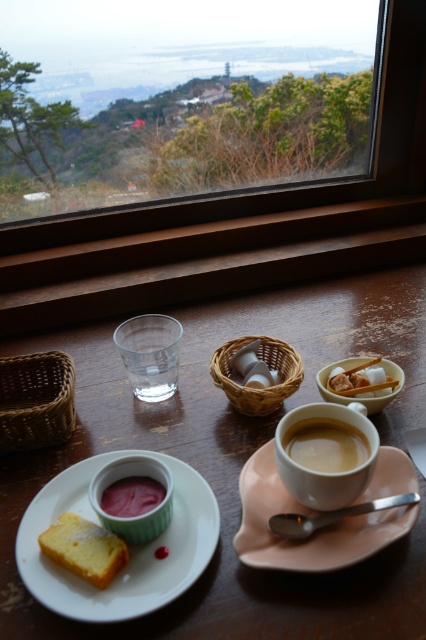
Question: Considering the relative positions of wooden table at center and pink matte saucer at center in the image provided, where is wooden table at center located with respect to pink matte saucer at center?

Choices:
 (A) below
 (B) above

Answer: (B)

Question: Which point appears closest to the camera in this image?

Choices:
 (A) (118, 492)
 (B) (8, 362)

Answer: (A)

Question: Among these objects, which one is nearest to the camera?

Choices:
 (A) white ceramic plate at lower left
 (B) transparent glass window at upper center
 (C) pink matte saucer at center

Answer: (A)

Question: Does transparent glass window at upper center have a greater width compared to yellow sponge cake at lower left?

Choices:
 (A) no
 (B) yes

Answer: (B)

Question: Does wooden table at center have a smaller size compared to white matte sugar cubes at center?

Choices:
 (A) no
 (B) yes

Answer: (A)

Question: Among these points, which one is farthest from the camera?

Choices:
 (A) (118, 515)
 (B) (224, 376)
 (C) (196, 296)

Answer: (C)